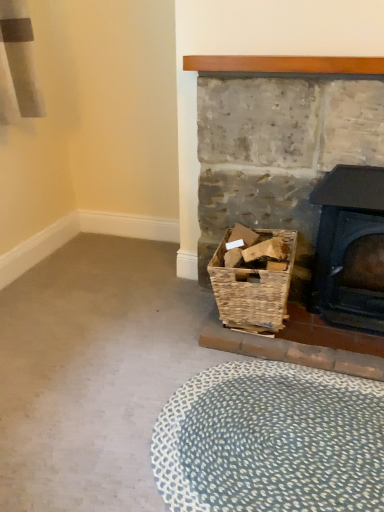
You are a GUI agent. You are given a task and a screenshot of the screen. Output one action in this format:
    pyautogui.click(x=<x>, y=<y>)
    Task: Click on the blank area beneath black cast iron wood burning stove at right (from a real-world perspective)
    This screenshot has height=512, width=384.
    Given the screenshot: What is the action you would take?
    pyautogui.click(x=331, y=322)